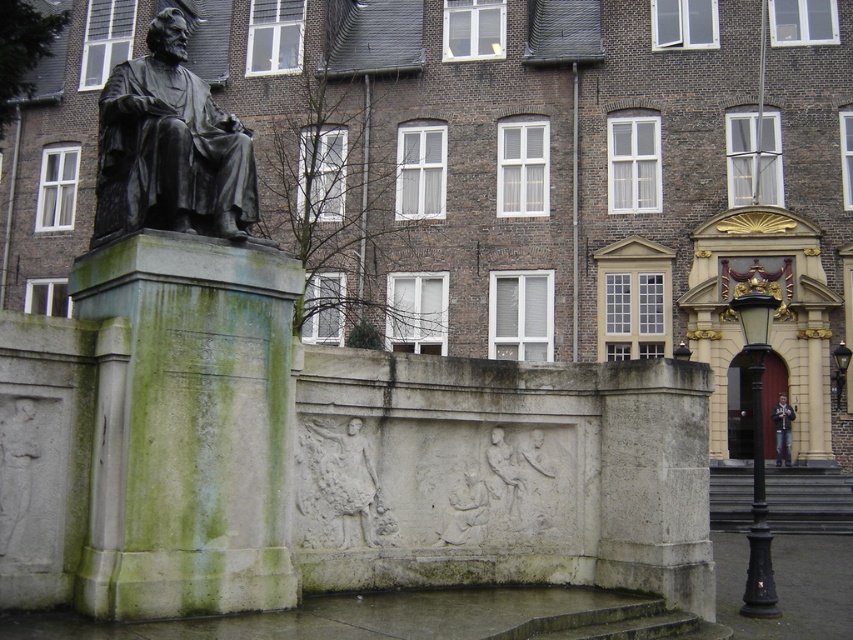
You are standing in front of the historical monument and want to place a small flowerpot between the green mossy stone at left and the bronze statue at left. Which object should the flowerpot be closer to if it needs to be placed on the ground level?

The flowerpot should be placed closer to the green mossy stone at left because it has a lesser height compared to the bronze statue at left, making its base more accessible at ground level.

In the scene shown: You are an architect assessing the monument. You need to place a protective covering over both the green mossy stone at left and the white stone relief at center. Which object requires a larger covering based on their widths?

The green mossy stone at left might be wider than the white stone relief at center, so it likely requires a larger covering.

You are standing at the center of the image. Which direction should you move to reach the bronze statue at left?

Since the bronze statue at left is located at coordinates approximately 0.231 on the x and 0.199 on the y axis, you should move to the left and slightly forward to reach it from the center.